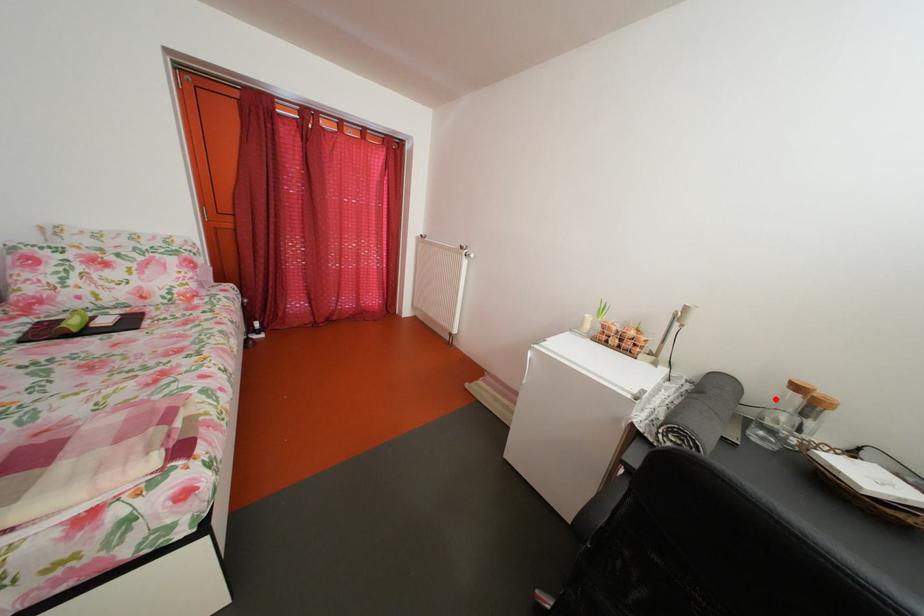
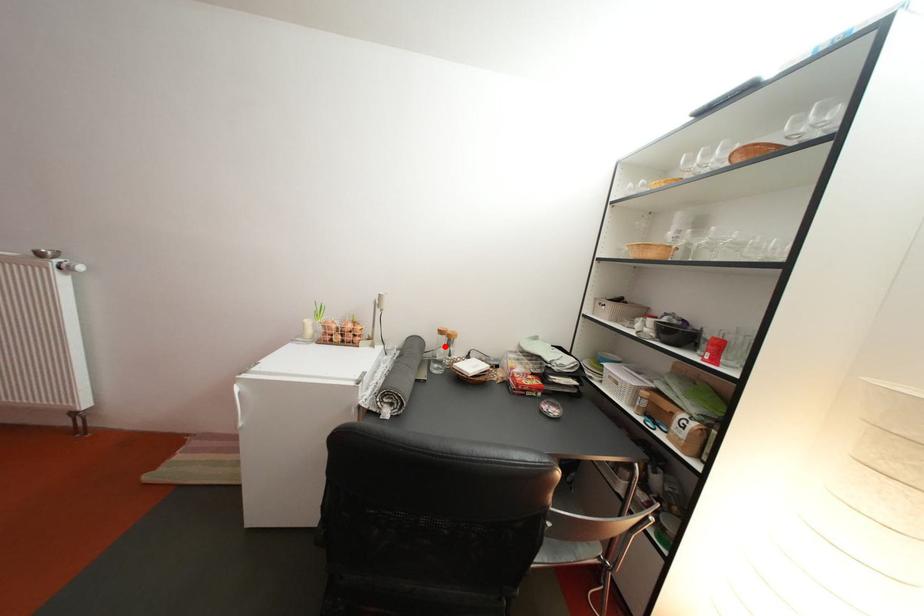
I am providing you with two images of the same scene from different viewpoints. A red point is marked on the first image and another point is marked on the second image. Is the red point in image1 aligned with the point shown in image2?

Yes